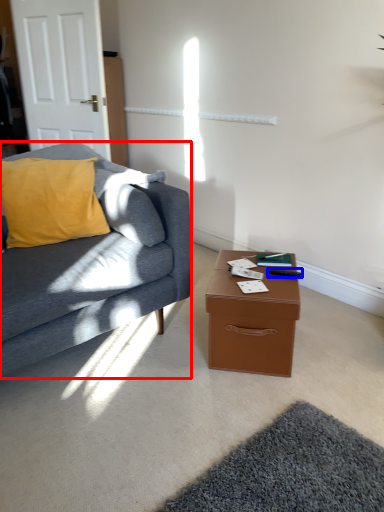
Question: Which of the following is the closest to the observer, studio couch (highlighted by a red box) or remote control (highlighted by a blue box)?

Choices:
 (A) studio couch
 (B) remote control

Answer: (A)